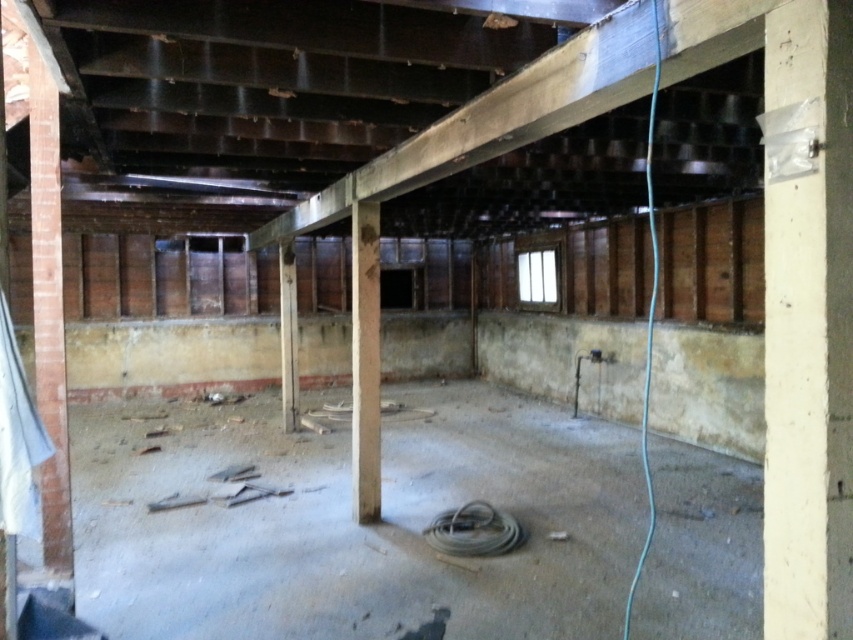
Does white painted wood pillar at right have a smaller size compared to concrete/rough pillar at center?

Indeed, white painted wood pillar at right has a smaller size compared to concrete/rough pillar at center.

Is point (811, 241) behind point (374, 323)?

No, (811, 241) is closer to viewer.

In order to click on white painted wood pillar at right in this screenshot , I will do `click(809, 333)`.

Between dark brown wooden beam at upper center and concrete/rough pillar at center, which one has more height?

concrete/rough pillar at center is taller.

Between point (625, 90) and point (369, 419), which one is positioned behind?

The point (369, 419) is behind.

Between point (445, 124) and point (376, 280), which one is positioned behind?

Point (376, 280)

Where is `dark brown wooden beam at upper center`? dark brown wooden beam at upper center is located at coordinates (496, 120).

Is white painted wood pillar at right below dark brown wooden beam at upper center?

Correct, white painted wood pillar at right is located below dark brown wooden beam at upper center.

Is point (830, 435) in front of point (724, 28)?

Yes.

You are a GUI agent. You are given a task and a screenshot of the screen. Output one action in this format:
    pyautogui.click(x=<x>, y=<y>)
    Task: Click on the white painted wood pillar at right
    
    Given the screenshot: What is the action you would take?
    pyautogui.click(x=809, y=333)